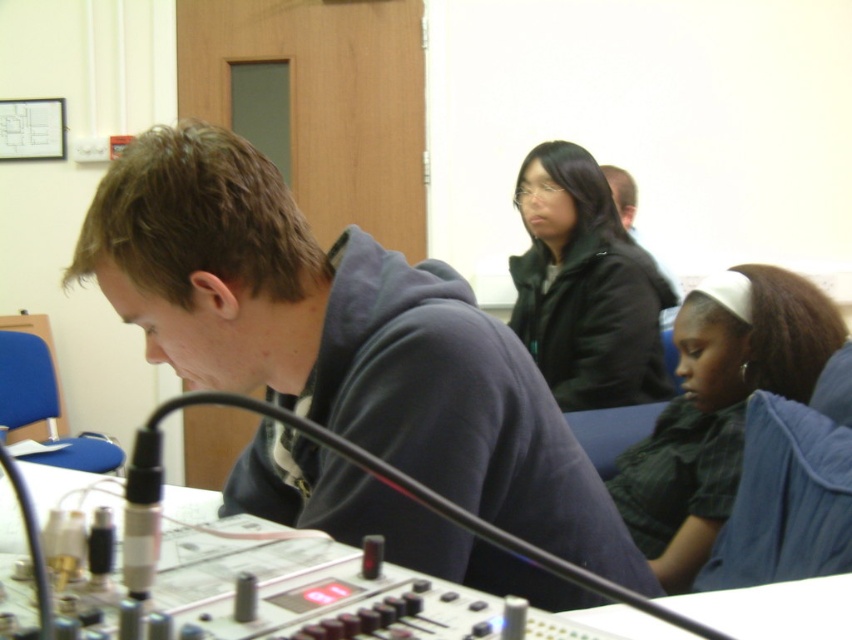
Between dark green fabric shirt at lower right and matte black jacket at center, which one has less height?

dark green fabric shirt at lower right

Is dark green fabric shirt at lower right to the right of matte black jacket at center from the viewer's perspective?

Yes, dark green fabric shirt at lower right is to the right of matte black jacket at center.

Is point (640, 506) more distant than point (568, 257)?

No, (640, 506) is closer to viewer.

The width and height of the screenshot is (852, 640). Identify the location of dark green fabric shirt at lower right. (718, 406).

Is dark green fabric shirt at lower right bigger than matte black jacket at upper center?

Indeed, dark green fabric shirt at lower right has a larger size compared to matte black jacket at upper center.

Which is behind, point (732, 285) or point (671, 272)?

Positioned behind is point (671, 272).

Where is `dark green fabric shirt at lower right`? dark green fabric shirt at lower right is located at coordinates (718, 406).

Which of these two, matte black jacket at center or matte black jacket at upper center, stands taller?

matte black jacket at center is taller.

Describe the element at coordinates (585, 285) in the screenshot. I see `matte black jacket at center` at that location.

This screenshot has width=852, height=640. I want to click on matte black jacket at center, so click(585, 285).